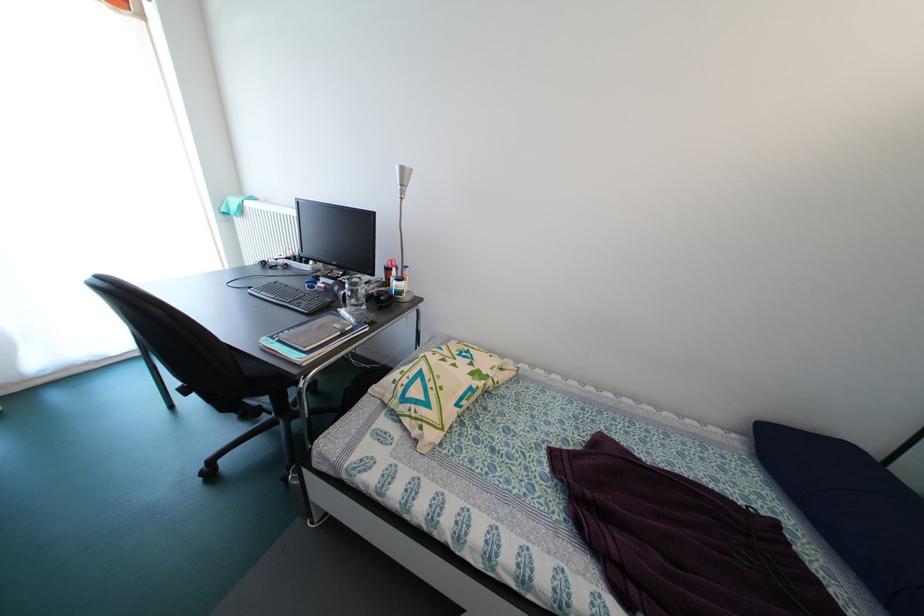
Find where to open the grey notebook. Please return your answer as a coordinate pair (x, y).

(314, 331)